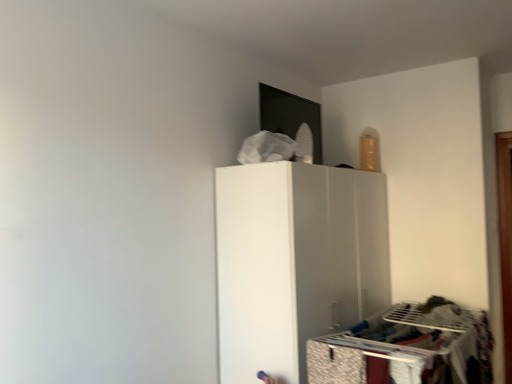
What do you see at coordinates (334, 364) in the screenshot?
I see `patterned fabric drawer at lower right` at bounding box center [334, 364].

This screenshot has height=384, width=512. What are the coordinates of `patterned fabric drawer at lower right` in the screenshot? It's located at (334, 364).

Based on the photo, measure the distance between patterned fabric drawer at lower right and camera.

patterned fabric drawer at lower right is 5.97 feet from camera.

In order to face patterned fabric drawer at lower right, should I rotate leftwards or rightwards?

A 10.683 degree turn to the right will do.

Measure the distance between point (351, 353) and camera.

A distance of 6.28 feet exists between point (351, 353) and camera.

This screenshot has width=512, height=384. Describe the element at coordinates (295, 261) in the screenshot. I see `white matte cabinet at center` at that location.

Find the location of a particular element. white matte cabinet at center is located at coordinates (295, 261).

I want to click on patterned fabric drawer at lower right, so click(x=334, y=364).

Which is more to the left, patterned fabric drawer at lower right or white matte cabinet at center?

From the viewer's perspective, patterned fabric drawer at lower right appears more on the left side.

Which object is further away from the camera, patterned fabric drawer at lower right or white matte cabinet at center?

white matte cabinet at center.

Is point (314, 349) closer or farther from the camera than point (268, 209)?

Point (314, 349).

From the image's perspective, is patterned fabric drawer at lower right above or below white matte cabinet at center?

From the image's perspective, patterned fabric drawer at lower right appears below white matte cabinet at center.

From a real-world perspective, which is physically below, patterned fabric drawer at lower right or white matte cabinet at center?

patterned fabric drawer at lower right.

Looking at their sizes, would you say patterned fabric drawer at lower right is wider or thinner than white matte cabinet at center?

Clearly, patterned fabric drawer at lower right has less width compared to white matte cabinet at center.

Is patterned fabric drawer at lower right taller than white matte cabinet at center?

No, patterned fabric drawer at lower right is not taller than white matte cabinet at center.

Does patterned fabric drawer at lower right have a smaller size compared to white matte cabinet at center?

Yes, patterned fabric drawer at lower right is smaller than white matte cabinet at center.

Can we say patterned fabric drawer at lower right lies outside white matte cabinet at center?

Absolutely, patterned fabric drawer at lower right is external to white matte cabinet at center.

Would you say patterned fabric drawer at lower right is a long distance from white matte cabinet at center?

They are positioned close to each other.

From the picture: Is white matte cabinet at center at the back of patterned fabric drawer at lower right?

That's not correct — patterned fabric drawer at lower right is not looking away from white matte cabinet at center.

Can you tell me how much patterned fabric drawer at lower right and white matte cabinet at center differ in facing direction?

patterned fabric drawer at lower right and white matte cabinet at center are facing 0.111 degrees away from each other.

Measure the distance from patterned fabric drawer at lower right to white matte cabinet at center.

patterned fabric drawer at lower right is 20.48 inches away from white matte cabinet at center.

Find the location of `drawer lying in front of the white matte cabinet at center`. drawer lying in front of the white matte cabinet at center is located at coordinates (334, 364).

Consider the image. Between white matte cabinet at center and patterned fabric drawer at lower right, which one appears on the right side from the viewer's perspective?

white matte cabinet at center.

Based on the photo, considering the relative positions of white matte cabinet at center and patterned fabric drawer at lower right in the image provided, is white matte cabinet at center behind patterned fabric drawer at lower right?

Yes, white matte cabinet at center is further from the viewer.

Does point (278, 256) come in front of point (324, 355)?

No, it is behind (324, 355).

From the image's perspective, which is below, white matte cabinet at center or patterned fabric drawer at lower right?

patterned fabric drawer at lower right, from the image's perspective.

From a real-world perspective, is white matte cabinet at center located higher than patterned fabric drawer at lower right?

Yes, from a real-world perspective, white matte cabinet at center is above patterned fabric drawer at lower right.

Is white matte cabinet at center thinner than patterned fabric drawer at lower right?

No.

Can you confirm if white matte cabinet at center is taller than patterned fabric drawer at lower right?

Indeed, white matte cabinet at center has a greater height compared to patterned fabric drawer at lower right.

Looking at the image, does white matte cabinet at center seem bigger or smaller compared to patterned fabric drawer at lower right?

Clearly, white matte cabinet at center is larger in size than patterned fabric drawer at lower right.

Is white matte cabinet at center not within patterned fabric drawer at lower right?

Absolutely, white matte cabinet at center is external to patterned fabric drawer at lower right.

Looking at this image, is white matte cabinet at center next to patterned fabric drawer at lower right?

There is a gap between white matte cabinet at center and patterned fabric drawer at lower right.

Is white matte cabinet at center oriented away from patterned fabric drawer at lower right?

No, white matte cabinet at center's orientation is not away from patterned fabric drawer at lower right.

Can you tell me how much white matte cabinet at center and patterned fabric drawer at lower right differ in facing direction?

There is a 0.111-degree angle between the facing directions of white matte cabinet at center and patterned fabric drawer at lower right.

Measure the distance from white matte cabinet at center to patterned fabric drawer at lower right.

The distance of white matte cabinet at center from patterned fabric drawer at lower right is 20.48 inches.

This screenshot has width=512, height=384. I want to click on furniture lying on the right of patterned fabric drawer at lower right, so click(295, 261).

You are a GUI agent. You are given a task and a screenshot of the screen. Output one action in this format:
    pyautogui.click(x=<x>, y=<y>)
    Task: Click on the drawer in front of the white matte cabinet at center
    
    Given the screenshot: What is the action you would take?
    pyautogui.click(x=334, y=364)

Find the location of `furniture above the patterned fabric drawer at lower right (from the image's perspective)`. furniture above the patterned fabric drawer at lower right (from the image's perspective) is located at coordinates (295, 261).